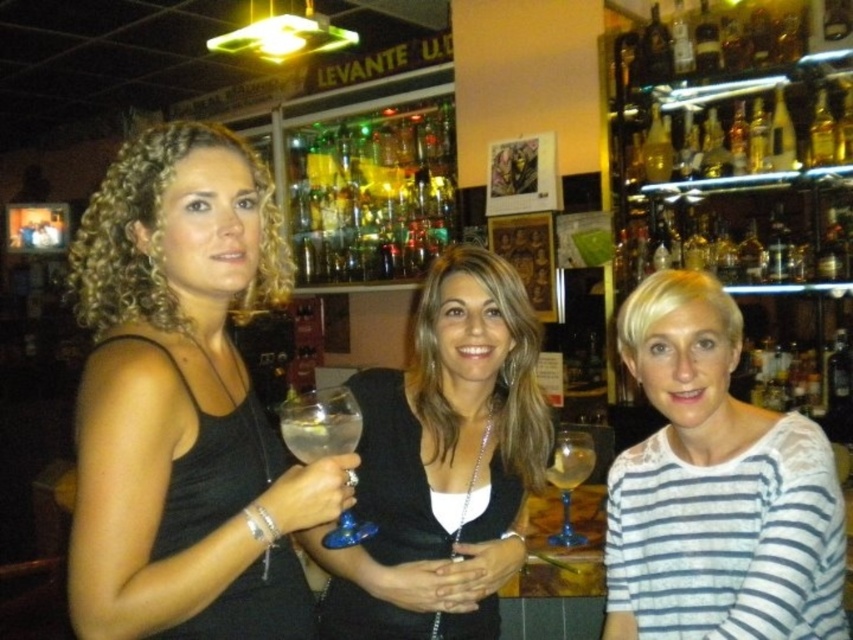
Who is taller, black matte tank top at left or translucent glass bottles at upper center?

translucent glass bottles at upper center is taller.

Between point (224, 243) and point (393, 109), which one is positioned behind?

Positioned behind is point (393, 109).

At what (x,y) coordinates should I click in order to perform the action: click on black matte tank top at left. Please return your answer as a coordinate pair (x, y). Looking at the image, I should click on (184, 403).

Measure the distance between point (404, 452) and camera.

Point (404, 452) is 1.36 meters away from camera.

Does black matte dress at center appear on the right side of transparent glass wine glass at center?

Correct, you'll find black matte dress at center to the right of transparent glass wine glass at center.

The image size is (853, 640). Identify the location of black matte dress at center. (445, 452).

Does point (799, 572) come behind point (337, 141)?

No, (799, 572) is in front of (337, 141).

Consider the image. Between white striped shirt at lower right and translucent glass bottles at upper center, which one appears on the right side from the viewer's perspective?

white striped shirt at lower right is more to the right.

Identify the location of white striped shirt at lower right. (x=715, y=488).

At what (x,y) coordinates should I click in order to perform the action: click on white striped shirt at lower right. Please return your answer as a coordinate pair (x, y). This screenshot has height=640, width=853. Looking at the image, I should click on (715, 488).